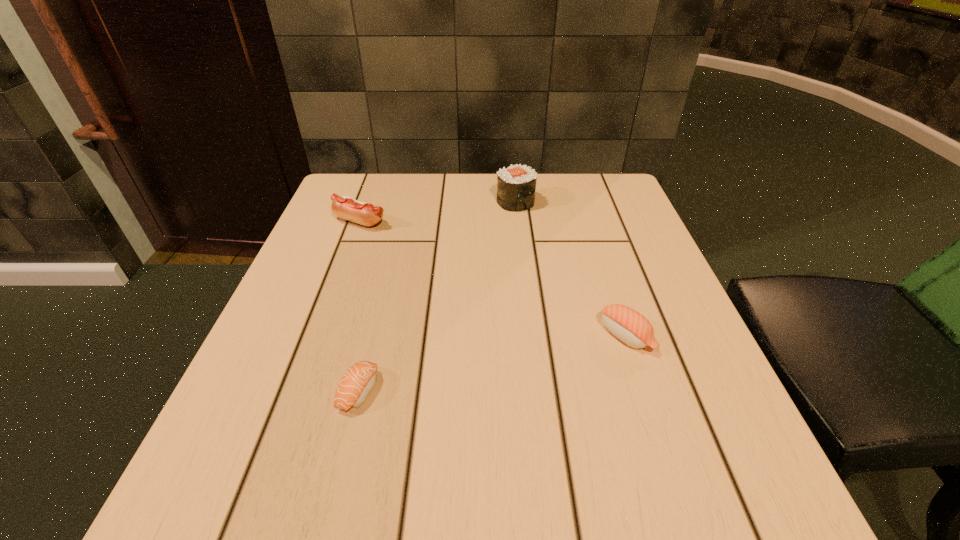
What are the coordinates of `free space located 0.120m on the right of the shortest sushi` in the screenshot? It's located at (455, 390).

Identify the location of sushi located at the far edge. Image resolution: width=960 pixels, height=540 pixels. (516, 185).

This screenshot has height=540, width=960. I want to click on sausage located at the far edge, so click(367, 214).

In order to click on sausage located in the left edge section of the desktop in this screenshot , I will do `click(367, 214)`.

This screenshot has width=960, height=540. Find the location of `sushi that is at the left edge`. sushi that is at the left edge is located at coordinates (358, 381).

Where is `object positioned at the right edge`? object positioned at the right edge is located at coordinates (628, 325).

This screenshot has width=960, height=540. Identify the location of object that is at the far left corner. (367, 214).

Locate an element on the screen. The height and width of the screenshot is (540, 960). vacant space at the far edge of the desktop is located at coordinates (444, 185).

This screenshot has width=960, height=540. I want to click on blank area at the left edge, so click(x=358, y=242).

Locate an element on the screen. vacant space at the right edge of the desktop is located at coordinates (731, 425).